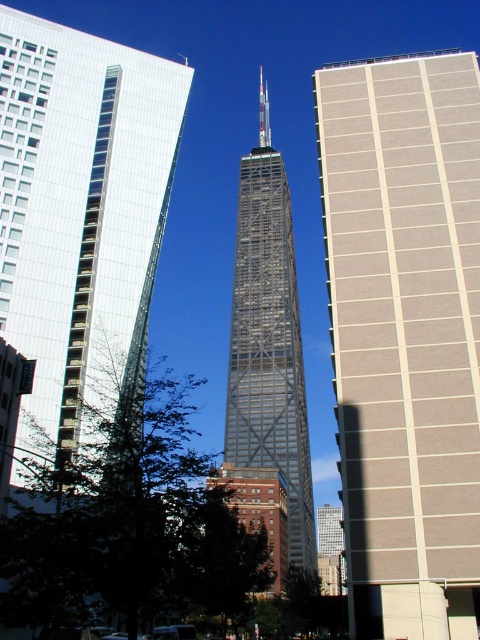
Who is positioned more to the left, beige textured building at right or glassy steel tower at center?

glassy steel tower at center is more to the left.

Which is above, beige textured building at right or glassy steel tower at center?

Positioned higher is glassy steel tower at center.

Is point (434, 211) in front of point (280, 573)?

Yes, it is.

Identify the location of beige textured building at right. (405, 333).

You are a GUI agent. You are given a task and a screenshot of the screen. Output one action in this format:
    pyautogui.click(x=<x>, y=<y>)
    Task: Click on the green leafy tree at lower left
    This screenshot has height=640, width=480.
    Given the screenshot: What is the action you would take?
    pyautogui.click(x=130, y=524)

Find the location of a particular element. The image size is (480, 640). green leafy tree at lower left is located at coordinates (130, 524).

Between point (424, 588) and point (103, 445), which one is positioned behind?

Point (103, 445)

Is beige textured building at right to the left of green leafy tree at lower left from the viewer's perspective?

No, beige textured building at right is not to the left of green leafy tree at lower left.

Is point (393, 189) closer to viewer compared to point (182, 547)?

No, it is not.

The width and height of the screenshot is (480, 640). In order to click on beige textured building at right in this screenshot , I will do `click(405, 333)`.